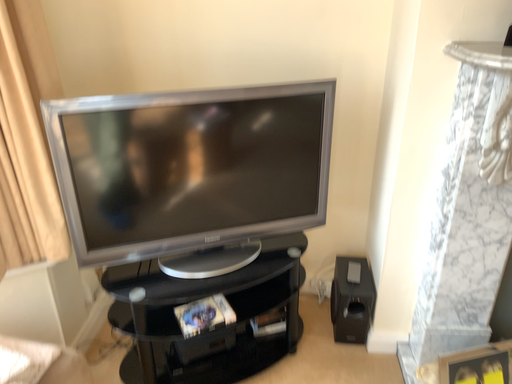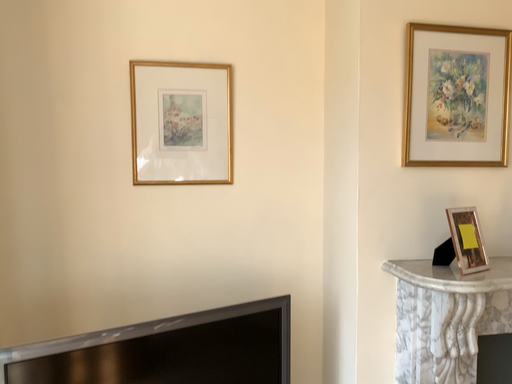
Question: How did the camera likely rotate when shooting the video?

Choices:
 (A) rotated upward
 (B) rotated downward

Answer: (A)